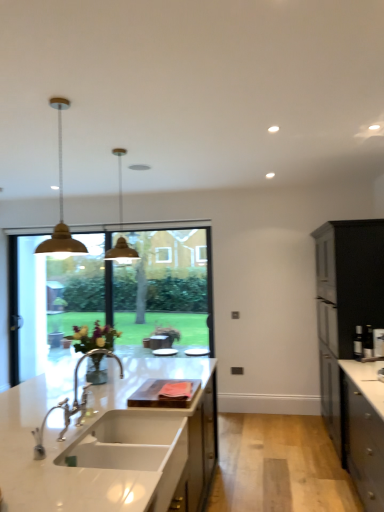
Question: From the image's perspective, would you say metallic gold pendant light at center is positioned over black matte cabinet at right?

Choices:
 (A) no
 (B) yes

Answer: (B)

Question: Is black matte cabinet at right at the back of metallic gold pendant light at center?

Choices:
 (A) yes
 (B) no

Answer: (B)

Question: Is metallic gold pendant light at center positioned far away from black matte cabinet at right?

Choices:
 (A) yes
 (B) no

Answer: (A)

Question: Is metallic gold pendant light at center closer to the viewer compared to black matte cabinet at right?

Choices:
 (A) no
 (B) yes

Answer: (B)

Question: Is metallic gold pendant light at center at the right side of black matte cabinet at right?

Choices:
 (A) no
 (B) yes

Answer: (A)

Question: Is black matte cabinet at right wider or thinner than chrome metallic faucet at sink left?

Choices:
 (A) thin
 (B) wide

Answer: (B)

Question: Considering the positions of black matte cabinet at right and chrome metallic faucet at sink left in the image, is black matte cabinet at right taller or shorter than chrome metallic faucet at sink left?

Choices:
 (A) tall
 (B) short

Answer: (A)

Question: Does point (359, 245) appear closer or farther from the camera than point (36, 448)?

Choices:
 (A) closer
 (B) farther

Answer: (B)

Question: Considering the positions of black matte cabinet at right and chrome metallic faucet at sink left in the image, is black matte cabinet at right bigger or smaller than chrome metallic faucet at sink left?

Choices:
 (A) big
 (B) small

Answer: (A)

Question: From their relative heights in the image, would you say white marble countertop at center is taller or shorter than metallic gold pendant light at center?

Choices:
 (A) short
 (B) tall

Answer: (B)

Question: Considering the positions of point click(x=135, y=387) and point click(x=117, y=162), is point click(x=135, y=387) closer or farther from the camera than point click(x=117, y=162)?

Choices:
 (A) farther
 (B) closer

Answer: (B)

Question: Is white marble countertop at center inside or outside of metallic gold pendant light at center?

Choices:
 (A) inside
 (B) outside

Answer: (B)

Question: Considering their positions, is white marble countertop at center located in front of or behind metallic gold pendant light at center?

Choices:
 (A) behind
 (B) front

Answer: (B)

Question: In terms of size, does metallic gold pendant light at center appear bigger or smaller than white glossy sink at center?

Choices:
 (A) small
 (B) big

Answer: (A)

Question: Considering the relative positions of metallic gold pendant light at center and white glossy sink at center in the image provided, is metallic gold pendant light at center to the left or to the right of white glossy sink at center?

Choices:
 (A) left
 (B) right

Answer: (A)